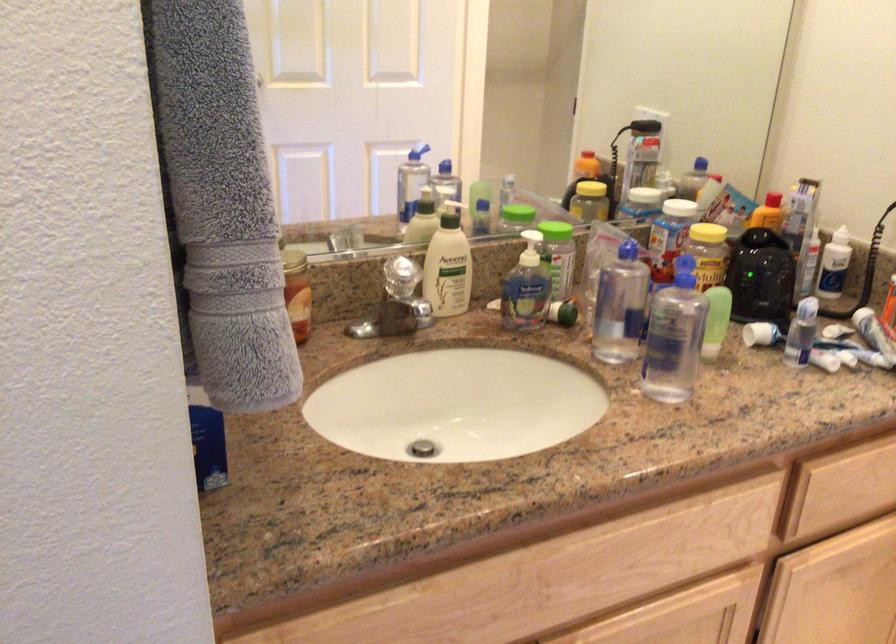
Locate an element on the screen. crystal faucet handle is located at coordinates (380, 305).